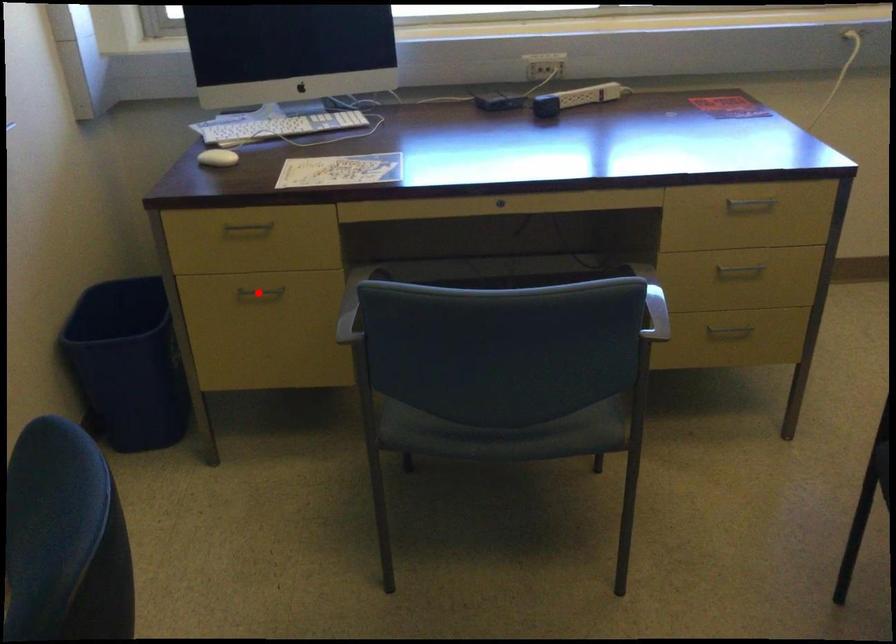
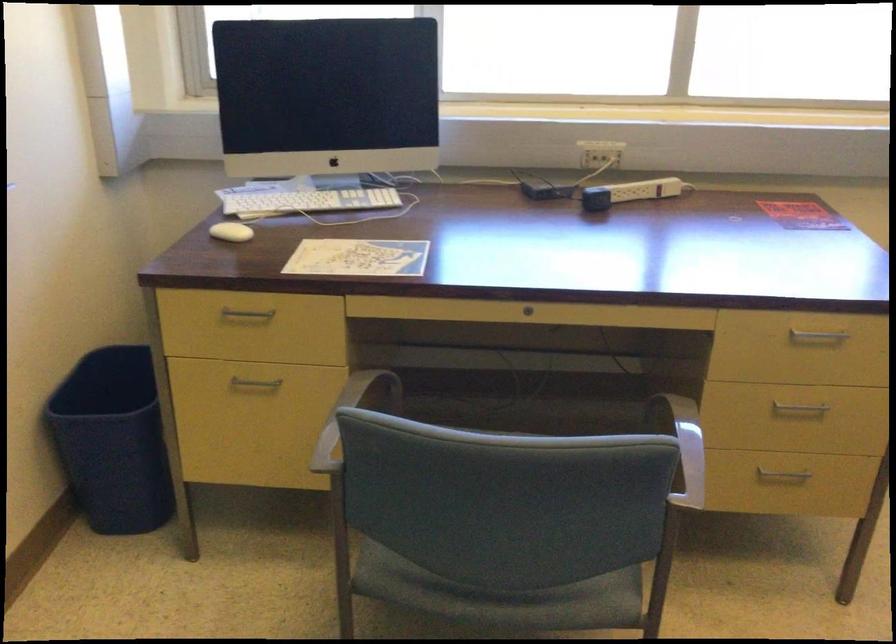
In the second image, find the point that corresponds to the highlighted location in the first image.

(254, 384)